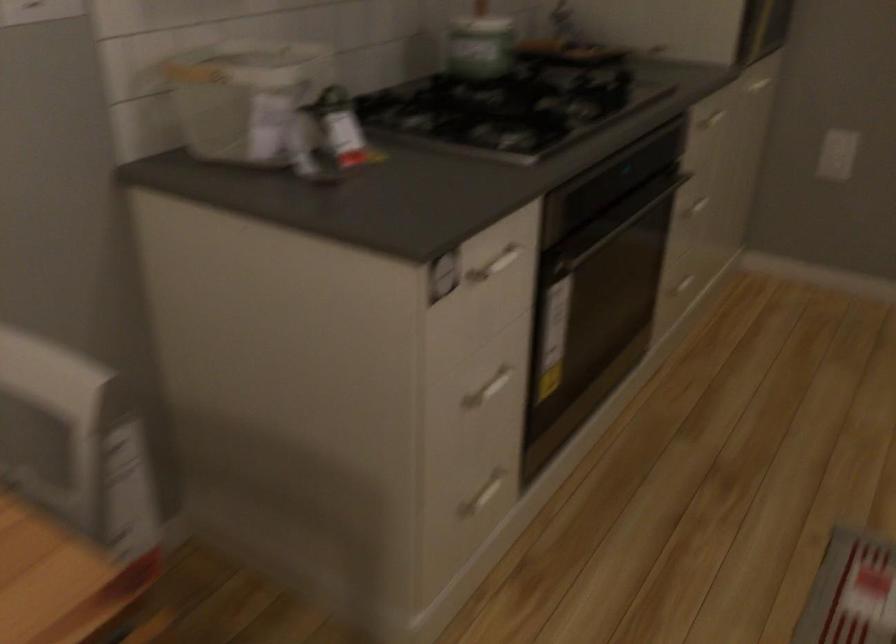
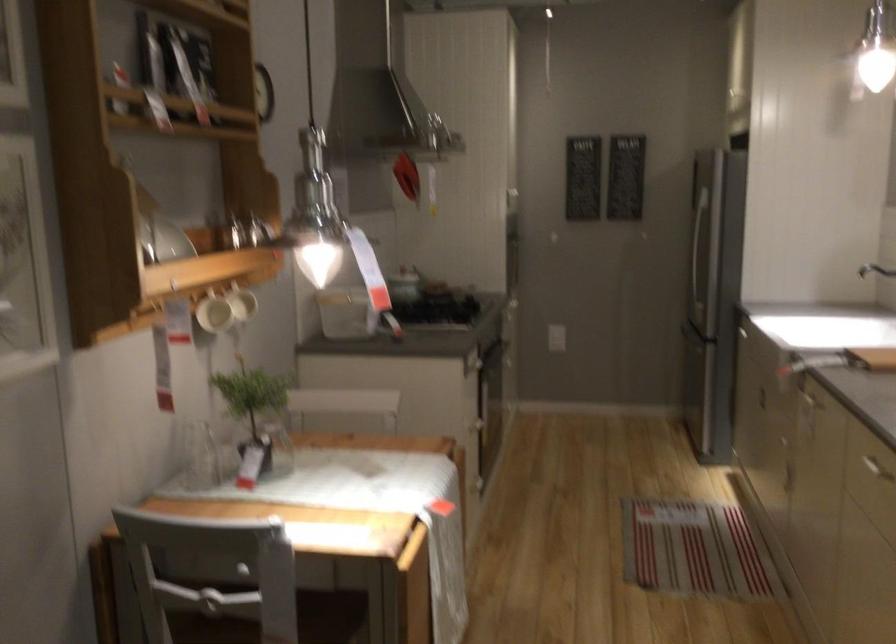
Where in the second image is the point corresponding to (545,236) from the first image?

(489, 354)